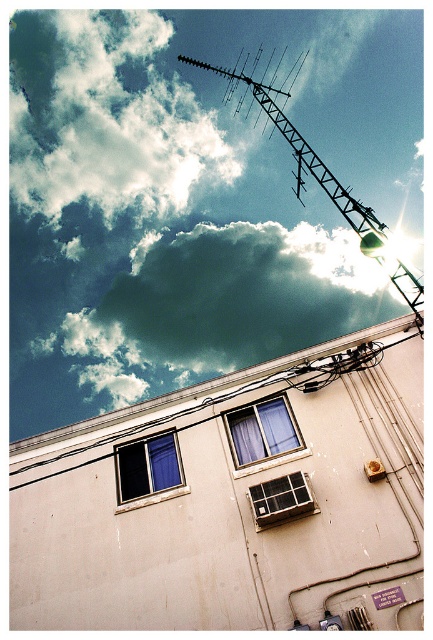
Which of these two, metallic antenna at upper center or wooden frame window at center, stands taller?

metallic antenna at upper center

Looking at this image, can you confirm if metallic antenna at upper center is thinner than wooden frame window at center?

No, metallic antenna at upper center is not thinner than wooden frame window at center.

Does point (272, 90) lie in front of point (271, 397)?

That is False.

At what (x,y) coordinates should I click in order to perform the action: click on metallic antenna at upper center. Please return your answer as a coordinate pair (x, y). The image size is (433, 640). Looking at the image, I should click on (319, 172).

Can you confirm if metallic antenna at upper center is bigger than blue glass window at center?

Yes.

Which is in front, point (416, 288) or point (174, 467)?

Positioned in front is point (416, 288).

Measure the distance between metallic antenna at upper center and camera.

metallic antenna at upper center and camera are 31.76 feet apart from each other.

At what (x,y) coordinates should I click in order to perform the action: click on metallic antenna at upper center. Please return your answer as a coordinate pair (x, y). The height and width of the screenshot is (640, 433). Looking at the image, I should click on [x=319, y=172].

Who is lower down, black wire at center or blue glass window at center?

Positioned lower is blue glass window at center.

The width and height of the screenshot is (433, 640). I want to click on black wire at center, so click(x=210, y=396).